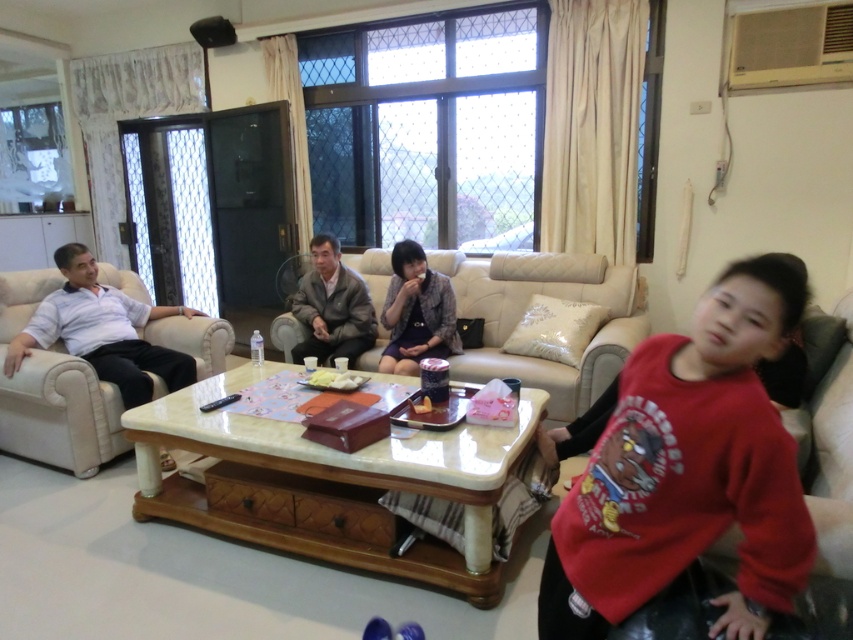
Question: Among these objects, which one is nearest to the camera?

Choices:
 (A) dark gray fabric jacket at center
 (B) red cotton shirt at right
 (C) beige quilted couch at center
 (D) patterned fabric dress at center

Answer: (B)

Question: Does beige quilted couch at center come behind beige leather couch at left?

Choices:
 (A) yes
 (B) no

Answer: (A)

Question: Which object is closer to the camera taking this photo?

Choices:
 (A) patterned fabric dress at center
 (B) red cotton shirt at right
 (C) dark gray fabric jacket at center
 (D) beige quilted couch at center

Answer: (B)

Question: Which point is closer to the camera?

Choices:
 (A) beige quilted couch at center
 (B) red cotton shirt at right
 (C) beige leather couch at left

Answer: (B)

Question: Does beige quilted couch at center appear on the right side of beige leather couch at left?

Choices:
 (A) yes
 (B) no

Answer: (A)

Question: In this image, where is beige leather couch at left located relative to patterned fabric dress at center?

Choices:
 (A) below
 (B) above

Answer: (A)